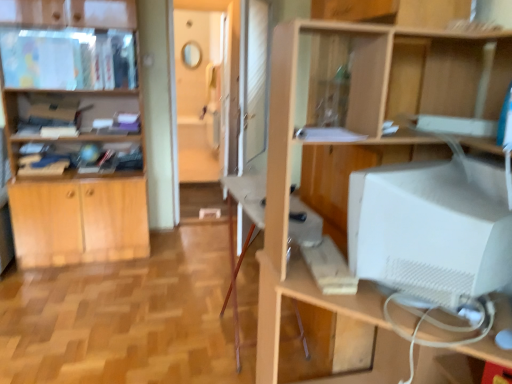
What are the coordinates of `vacant space in front of light wood cabinet at left` in the screenshot? It's located at (71, 292).